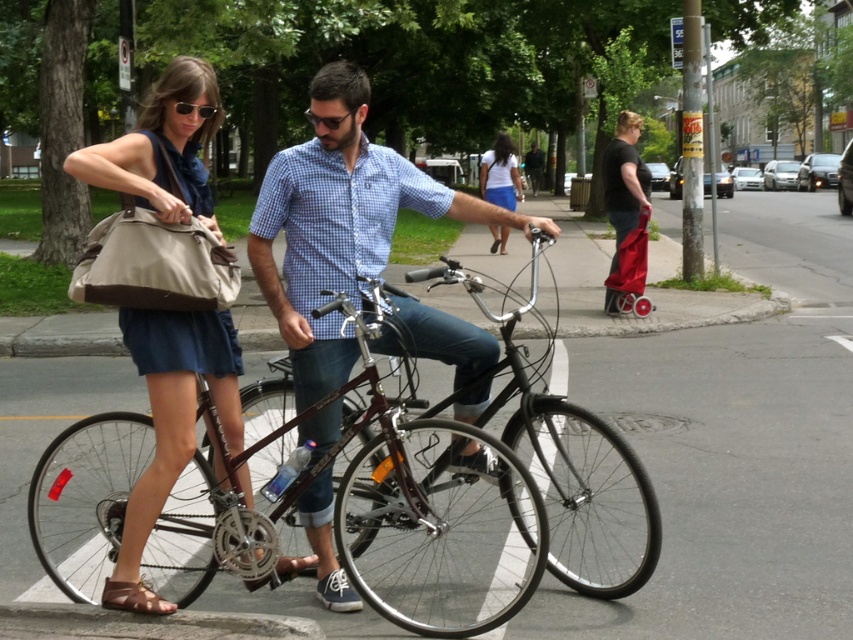
Who is higher up, matte blue shirt at center or matte beige tote bag at left?

matte blue shirt at center is higher up.

Does matte blue shirt at center have a lesser width compared to matte beige tote bag at left?

No, matte blue shirt at center is not thinner than matte beige tote bag at left.

Find the location of a particular element. Image resolution: width=853 pixels, height=640 pixels. matte blue shirt at center is located at coordinates (340, 225).

This screenshot has height=640, width=853. Find the location of `matte blue shirt at center`. matte blue shirt at center is located at coordinates (340, 225).

Is shiny black bicycle at center bigger than matte blue shirt at center?

Indeed, shiny black bicycle at center has a larger size compared to matte blue shirt at center.

Does shiny black bicycle at center appear on the right side of matte blue shirt at center?

In fact, shiny black bicycle at center is to the left of matte blue shirt at center.

This screenshot has height=640, width=853. I want to click on shiny black bicycle at center, so click(x=488, y=500).

Image resolution: width=853 pixels, height=640 pixels. Find the location of `shiny black bicycle at center`. shiny black bicycle at center is located at coordinates (488, 500).

Is point (328, 104) more distant than point (490, 173)?

No, it is in front of (490, 173).

Is point (322, 436) in front of point (490, 161)?

Yes.

The height and width of the screenshot is (640, 853). What are the coordinates of `matte blue shirt at center` in the screenshot? It's located at (340, 225).